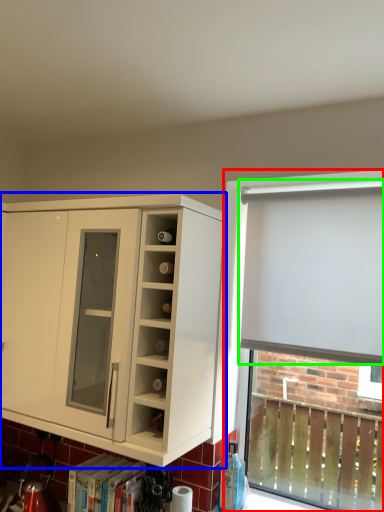
Question: Which object is positioned farthest from bay window (highlighted by a red box)? Select from cabinetry (highlighted by a blue box) and curtain (highlighted by a green box).

Choices:
 (A) cabinetry
 (B) curtain

Answer: (A)